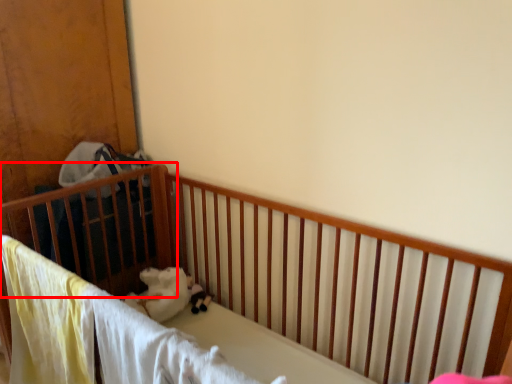
Question: From the image's perspective, considering the relative positions of infant bed (annotated by the red box) and toy in the image provided, where is infant bed (annotated by the red box) located with respect to the staircase?

Choices:
 (A) above
 (B) below

Answer: (A)